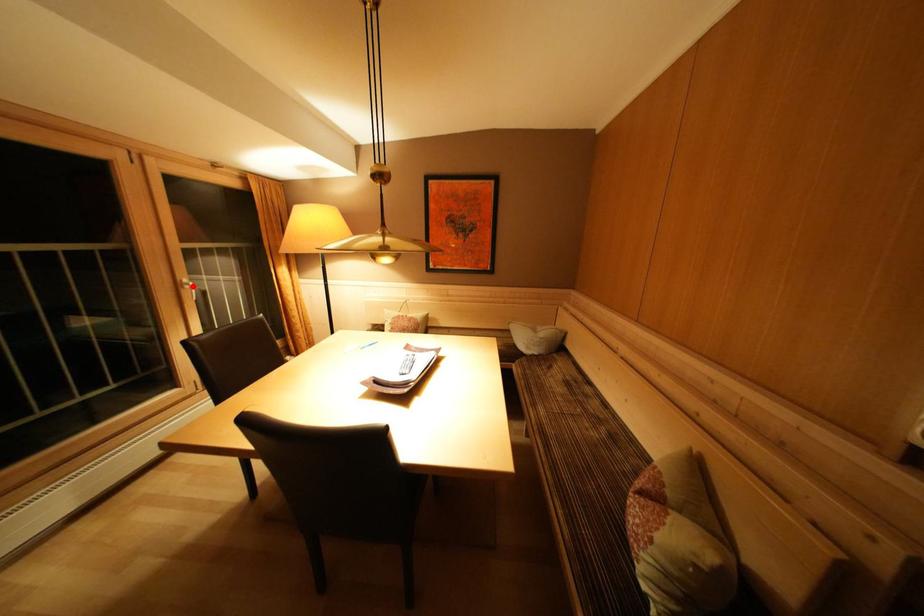
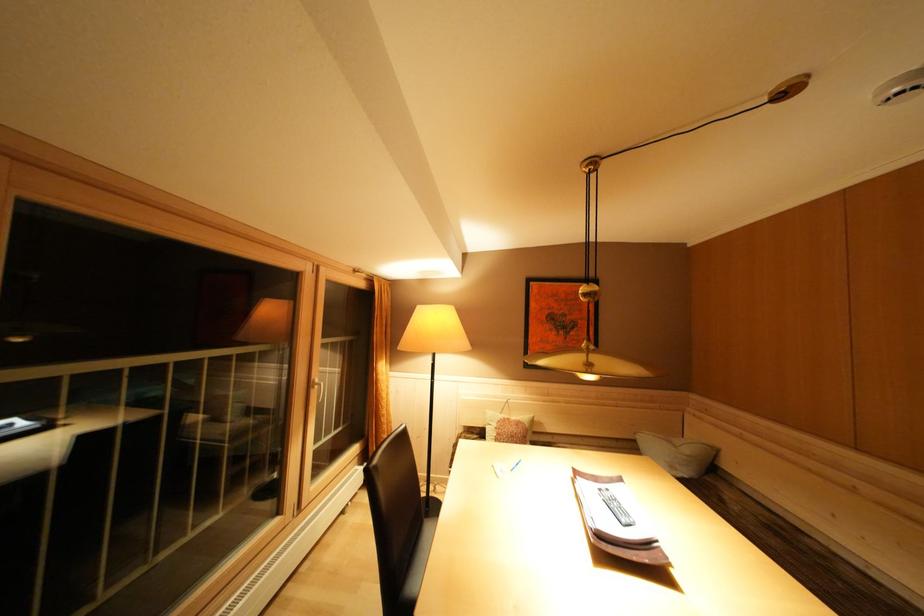
Question: I am providing you with two images of the same scene from different viewpoints. In image1, a red point is highlighted. Considering the same 3D point in image2, which of the following is correct?

Choices:
 (A) It is closer
 (B) It is farther

Answer: (B)